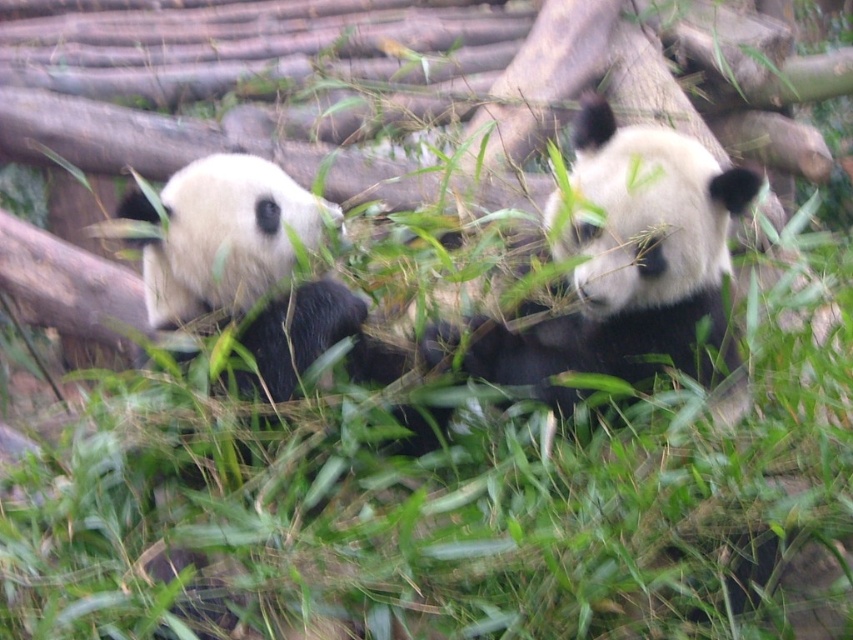
You are a zookeeper observing two pandas in their enclosure. You notice the black and white fur panda at center and the white fur panda at left. Which panda is smaller in size?

The black and white fur panda at center is smaller in size compared to the white fur panda at left.

You are a zookeeper who needs to separate the two pandas for feeding. The minimum safe distance required between them is 18 inches. Based on the image, will you need to move the black and white fur panda at center and the white fur panda at left further apart?

The black and white fur panda at center is 18.28 inches away from the white fur panda at left. Since 18.28 inches is slightly more than the required 18 inches, they are already at a safe distance and do not need to be moved further apart.

You are standing in a zoo enclosure and see the black and white fur panda at center. If you want to toss a piece of bamboo to the panda without entering the enclosure, what is the minimum distance you need to throw it?

The minimum distance you need to throw the bamboo to reach the black and white fur panda at center is 1.93 meters, as that is the distance between the panda and the viewer.